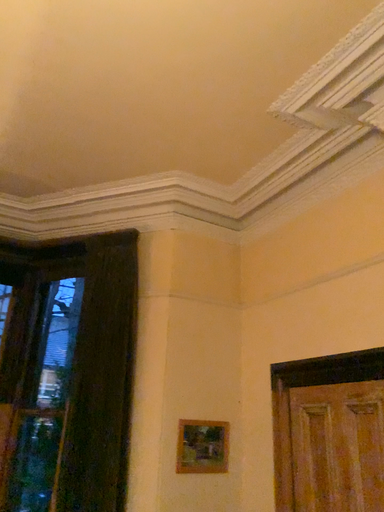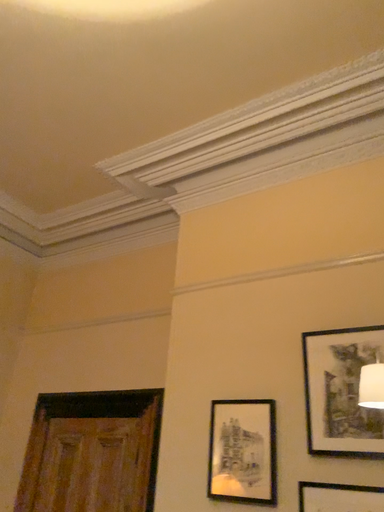
Question: Which way did the camera rotate in the video?

Choices:
 (A) rotated left
 (B) rotated right

Answer: (B)